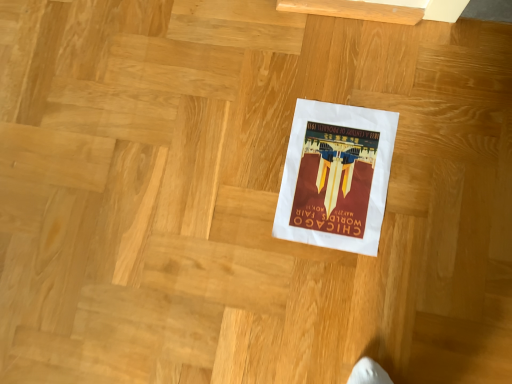
You are a GUI agent. You are given a task and a screenshot of the screen. Output one action in this format:
    pyautogui.click(x=<x>, y=<y>)
    Task: Click on the white paper at center
    
    Given the screenshot: What is the action you would take?
    pyautogui.click(x=152, y=196)

The width and height of the screenshot is (512, 384). What do you see at coordinates (152, 196) in the screenshot?
I see `white paper at center` at bounding box center [152, 196].

At what (x,y) coordinates should I click in order to perform the action: click on white paper poster at center. Please return your answer as a coordinate pair (x, y). Looking at the image, I should click on (336, 176).

What do you see at coordinates (336, 176) in the screenshot? The height and width of the screenshot is (384, 512). I see `white paper poster at center` at bounding box center [336, 176].

The image size is (512, 384). In order to click on white paper at center in this screenshot , I will do `click(152, 196)`.

Is white paper at center to the left or to the right of white paper poster at center in the image?

From the image, it's evident that white paper at center is to the left of white paper poster at center.

Considering the relative positions of white paper at center and white paper poster at center in the image provided, is white paper at center behind white paper poster at center?

No, white paper at center is in front of white paper poster at center.

Considering the points (87, 235) and (321, 227), which point is in front, point (87, 235) or point (321, 227)?

The point (321, 227) is closer to the camera.

From the image's perspective, is white paper at center located beneath white paper poster at center?

Yes, from the image's perspective, white paper at center is below white paper poster at center.

From a real-world perspective, is white paper at center above or below white paper poster at center?

From a real-world perspective, white paper at center is physically above white paper poster at center.

Can you confirm if white paper at center is thinner than white paper poster at center?

No.

Which of these two, white paper at center or white paper poster at center, stands shorter?

With less height is white paper poster at center.

Looking at the image, does white paper at center seem bigger or smaller compared to white paper poster at center?

Considering their sizes, white paper at center takes up more space than white paper poster at center.

Is white paper at center located outside white paper poster at center?

Yes.

Is there a large distance between white paper at center and white paper poster at center?

They are positioned close to each other.

Based on the photo, is white paper at center facing towards white paper poster at center?

No, white paper at center is not aimed at white paper poster at center.

What's the angular difference between white paper at center and white paper poster at center's facing directions?

There is a 89.1-degree angle between the facing directions of white paper at center and white paper poster at center.

Where is `stairwell that appears above the white paper poster at center (from a real-world perspective)`? The width and height of the screenshot is (512, 384). stairwell that appears above the white paper poster at center (from a real-world perspective) is located at coordinates (152, 196).

In the image, is white paper poster at center on the left side or the right side of white paper at center?

Clearly, white paper poster at center is on the right of white paper at center in the image.

Is the position of white paper poster at center more distant than that of white paper at center?

That is True.

Does point (368, 237) lie in front of point (70, 15)?

Yes, it is.

From the image's perspective, is white paper poster at center on top of white paper at center?

Yes, from the image's perspective, white paper poster at center is over white paper at center.

From a real-world perspective, is white paper poster at center positioned under white paper at center based on gravity?

Yes, from a real-world perspective, white paper poster at center is under white paper at center.

Can you confirm if white paper poster at center is wider than white paper at center?

In fact, white paper poster at center might be narrower than white paper at center.

Is white paper poster at center taller or shorter than white paper at center?

Clearly, white paper poster at center is shorter compared to white paper at center.

Who is smaller, white paper poster at center or white paper at center?

With smaller size is white paper poster at center.

Is white paper at center inside white paper poster at center?

Actually, white paper at center is outside white paper poster at center.

Would you say white paper poster at center is a long distance from white paper at center?

white paper poster at center is near white paper at center, not far away.

Is white paper poster at center facing away from white paper at center?

That's right, white paper poster at center is facing away from white paper at center.

How different are the orientations of white paper poster at center and white paper at center in degrees?

The angle between the facing direction of white paper poster at center and the facing direction of white paper at center is 89.1 degrees.

Identify the location of stairwell that is on the left side of white paper poster at center. This screenshot has width=512, height=384. (152, 196).

This screenshot has height=384, width=512. In order to click on poster above the white paper at center (from the image's perspective) in this screenshot , I will do `click(336, 176)`.

What are the coordinates of `stairwell lying below the white paper poster at center (from the image's perspective)` in the screenshot? It's located at (152, 196).